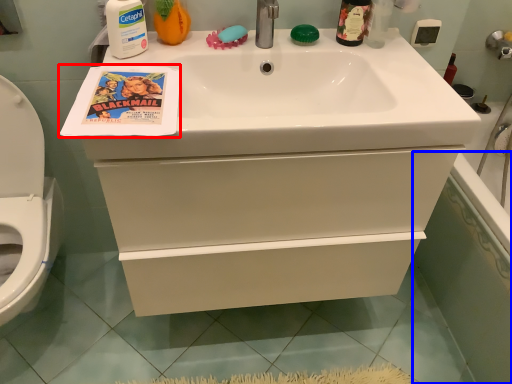
Question: Which point is further to the camera, comic book (highlighted by a red box) or bath (highlighted by a blue box)?

Choices:
 (A) comic book
 (B) bath

Answer: (B)